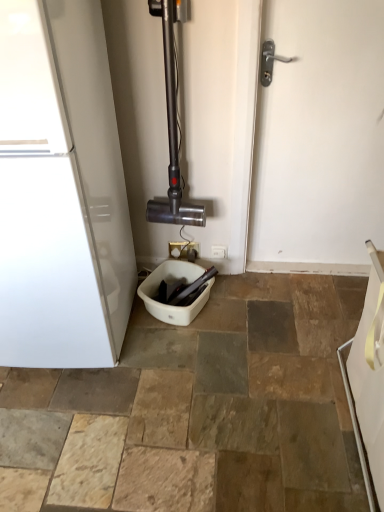
Question: Is white plastic toilet bowl at center next to white plastic electric outlet at center, the second electric outlet positioned from the right, and touching it?

Choices:
 (A) no
 (B) yes

Answer: (A)

Question: Considering the relative sizes of white plastic toilet bowl at center and white plastic electric outlet at center, the second electric outlet positioned from the right, in the image provided, is white plastic toilet bowl at center smaller than white plastic electric outlet at center, the second electric outlet positioned from the right,?

Choices:
 (A) no
 (B) yes

Answer: (A)

Question: Is white plastic toilet bowl at center not inside white plastic electric outlet at center, the second electric outlet positioned from the right?

Choices:
 (A) no
 (B) yes

Answer: (B)

Question: Is white plastic toilet bowl at center behind white plastic electric outlet at center, the second electric outlet positioned from the right?

Choices:
 (A) no
 (B) yes

Answer: (A)

Question: Is white plastic toilet bowl at center facing towards white plastic electric outlet at center, which is counted as the first electric outlet, starting from the left?

Choices:
 (A) no
 (B) yes

Answer: (A)

Question: Relative to white glossy towel at lower right, is white plastic electric outlet at center, which is counted as the first electric outlet, starting from the left, in front or behind?

Choices:
 (A) front
 (B) behind

Answer: (B)

Question: Considering the positions of white plastic electric outlet at center, which is counted as the first electric outlet, starting from the left, and white glossy towel at lower right in the image, is white plastic electric outlet at center, which is counted as the first electric outlet, starting from the left, wider or thinner than white glossy towel at lower right?

Choices:
 (A) wide
 (B) thin

Answer: (B)

Question: From the image's perspective, is white plastic electric outlet at center, the second electric outlet positioned from the right, located above or below white glossy towel at lower right?

Choices:
 (A) below
 (B) above

Answer: (B)

Question: Visually, is white plastic electric outlet at center, which is counted as the first electric outlet, starting from the left, positioned to the left or to the right of white glossy towel at lower right?

Choices:
 (A) right
 (B) left

Answer: (B)

Question: Considering the positions of metallic vacuum cleaner at center and white plastic toilet bowl at center in the image, is metallic vacuum cleaner at center wider or thinner than white plastic toilet bowl at center?

Choices:
 (A) wide
 (B) thin

Answer: (B)

Question: Based on their sizes in the image, would you say metallic vacuum cleaner at center is bigger or smaller than white plastic toilet bowl at center?

Choices:
 (A) small
 (B) big

Answer: (B)

Question: Is metallic vacuum cleaner at center in front of or behind white plastic toilet bowl at center in the image?

Choices:
 (A) behind
 (B) front

Answer: (B)

Question: From the image's perspective, is metallic vacuum cleaner at center located above or below white plastic toilet bowl at center?

Choices:
 (A) below
 (B) above

Answer: (B)

Question: Considering the positions of white glossy refrigerator at left and white plastic electric outlet at center, the first electric outlet positioned from the right, in the image, is white glossy refrigerator at left taller or shorter than white plastic electric outlet at center, the first electric outlet positioned from the right,?

Choices:
 (A) short
 (B) tall

Answer: (B)

Question: From the image's perspective, is white glossy refrigerator at left positioned above or below white plastic electric outlet at center, the 2th electric outlet from the left?

Choices:
 (A) below
 (B) above

Answer: (B)